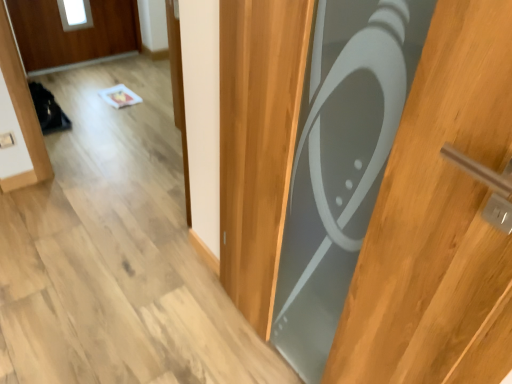
This screenshot has width=512, height=384. In order to click on white plastic electric outlet at lower left in this screenshot , I will do `click(6, 140)`.

The height and width of the screenshot is (384, 512). Describe the element at coordinates (6, 140) in the screenshot. I see `white plastic electric outlet at lower left` at that location.

Where is `matte gray door at center`? Image resolution: width=512 pixels, height=384 pixels. matte gray door at center is located at coordinates (438, 221).

Image resolution: width=512 pixels, height=384 pixels. Describe the element at coordinates (438, 221) in the screenshot. I see `matte gray door at center` at that location.

Where is `white plastic electric outlet at lower left`? white plastic electric outlet at lower left is located at coordinates [x=6, y=140].

Considering the relative positions of matte gray door at center and white plastic electric outlet at lower left in the image provided, is matte gray door at center to the left of white plastic electric outlet at lower left from the viewer's perspective?

Incorrect, matte gray door at center is not on the left side of white plastic electric outlet at lower left.

Which is in front, matte gray door at center or white plastic electric outlet at lower left?

Positioned in front is matte gray door at center.

Which is behind, point (424, 60) or point (3, 135)?

The point (3, 135) is more distant.

From the image's perspective, does matte gray door at center appear lower than white plastic electric outlet at lower left?

Yes, from the image's perspective, matte gray door at center is below white plastic electric outlet at lower left.

From a real-world perspective, is matte gray door at center beneath white plastic electric outlet at lower left?

No, from a real-world perspective, matte gray door at center is not under white plastic electric outlet at lower left.

Considering the sizes of objects matte gray door at center and white plastic electric outlet at lower left in the image provided, who is thinner, matte gray door at center or white plastic electric outlet at lower left?

white plastic electric outlet at lower left.

Can you confirm if matte gray door at center is shorter than white plastic electric outlet at lower left?

No.

Which of these two, matte gray door at center or white plastic electric outlet at lower left, is bigger?

matte gray door at center.

Is matte gray door at center spatially inside white plastic electric outlet at lower left, or outside of it?

matte gray door at center is not inside white plastic electric outlet at lower left, it's outside.

Is matte gray door at center not near white plastic electric outlet at lower left?

matte gray door at center is positioned a significant distance from white plastic electric outlet at lower left.

Could you tell me if matte gray door at center is turned towards white plastic electric outlet at lower left?

No, matte gray door at center does not turn towards white plastic electric outlet at lower left.

Based on the photo, what's the angular difference between matte gray door at center and white plastic electric outlet at lower left's facing directions?

The angle between the facing direction of matte gray door at center and the facing direction of white plastic electric outlet at lower left is 90.7 degrees.

At what (x,y) coordinates should I click in order to perform the action: click on electric outlet on the left of matte gray door at center. Please return your answer as a coordinate pair (x, y). The width and height of the screenshot is (512, 384). Looking at the image, I should click on (6, 140).

Does white plastic electric outlet at lower left appear on the left side of matte gray door at center?

Yes, white plastic electric outlet at lower left is to the left of matte gray door at center.

Is white plastic electric outlet at lower left positioned behind matte gray door at center?

Yes, it is.

Does point (8, 140) come farther from viewer compared to point (327, 361)?

Yes, point (8, 140) is behind point (327, 361).

From the image's perspective, is white plastic electric outlet at lower left positioned above or below matte gray door at center?

Based on their image positions, white plastic electric outlet at lower left is located above matte gray door at center.

From a real-world perspective, which object stands above the other?

From a 3D spatial view, matte gray door at center is above.

Is white plastic electric outlet at lower left thinner than matte gray door at center?

Yes, white plastic electric outlet at lower left is thinner than matte gray door at center.

Considering the sizes of objects white plastic electric outlet at lower left and matte gray door at center in the image provided, who is taller, white plastic electric outlet at lower left or matte gray door at center?

matte gray door at center.

In the scene shown: Does white plastic electric outlet at lower left have a larger size compared to matte gray door at center?

No, white plastic electric outlet at lower left is not bigger than matte gray door at center.

Can we say white plastic electric outlet at lower left lies outside matte gray door at center?

white plastic electric outlet at lower left is positioned outside matte gray door at center.

Is white plastic electric outlet at lower left beside matte gray door at center?

No, white plastic electric outlet at lower left is not beside matte gray door at center.

Is white plastic electric outlet at lower left oriented towards matte gray door at center?

Yes, white plastic electric outlet at lower left faces towards matte gray door at center.

How far apart are white plastic electric outlet at lower left and matte gray door at center?

white plastic electric outlet at lower left and matte gray door at center are 2.05 meters apart.

Where is `door in front of the white plastic electric outlet at lower left`? Image resolution: width=512 pixels, height=384 pixels. door in front of the white plastic electric outlet at lower left is located at coordinates (438, 221).

Where is `electric outlet below the matte gray door at center (from a real-world perspective)`? The image size is (512, 384). electric outlet below the matte gray door at center (from a real-world perspective) is located at coordinates (6, 140).

I want to click on door below the white plastic electric outlet at lower left (from the image's perspective), so click(x=438, y=221).